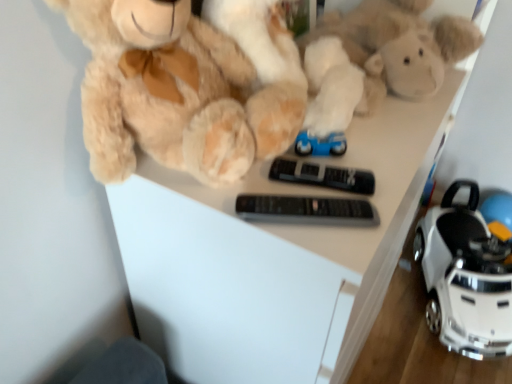
Question: Considering the positions of point (295, 104) and point (442, 289), is point (295, 104) closer or farther from the camera than point (442, 289)?

Choices:
 (A) farther
 (B) closer

Answer: (B)

Question: Would you say fluffy beige teddy bear at upper left is inside or outside white plastic toy car at lower right?

Choices:
 (A) outside
 (B) inside

Answer: (A)

Question: Which object is positioned closest to the fluffy beige teddy bear at upper left?

Choices:
 (A) white plastic toy car at lower right
 (B) black plastic remote at center, which is the 1th control from front to back
 (C) black plastic remote at center, the first control in the back-to-front sequence
 (D) soft plush toy at center

Answer: (C)

Question: Which is nearer to the black plastic remote at center, acting as the second control starting from the front?

Choices:
 (A) soft plush toy at center
 (B) black plastic remote at center, which is the 1th control from front to back
 (C) fluffy beige teddy bear at upper left
 (D) white plastic toy car at lower right

Answer: (B)